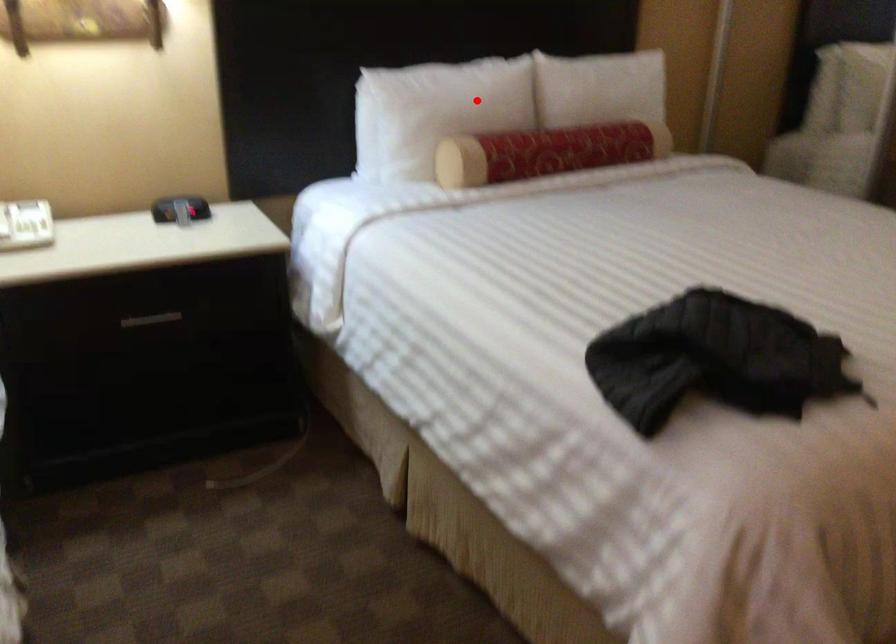
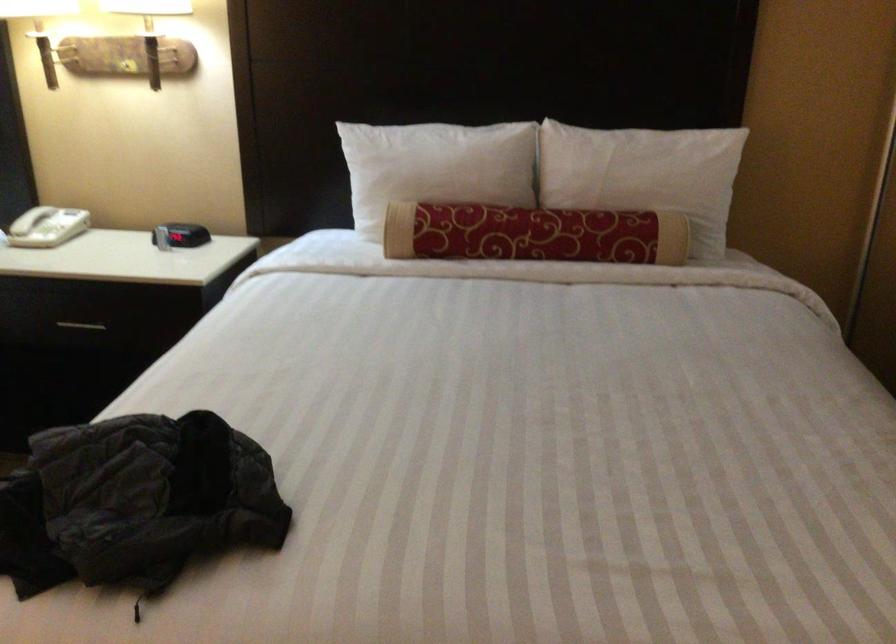
Question: I am providing you with two images of the same scene from different viewpoints. Given a red point in image1, look at the same physical point in image2. Is it:

Choices:
 (A) Closer to the viewpoint
 (B) Farther from the viewpoint

Answer: (A)